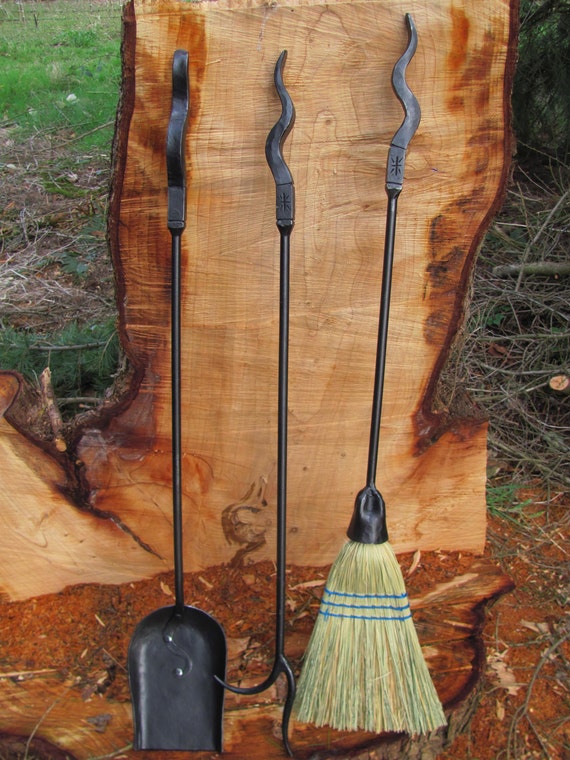
I want to click on broom straw, so click(374, 632).